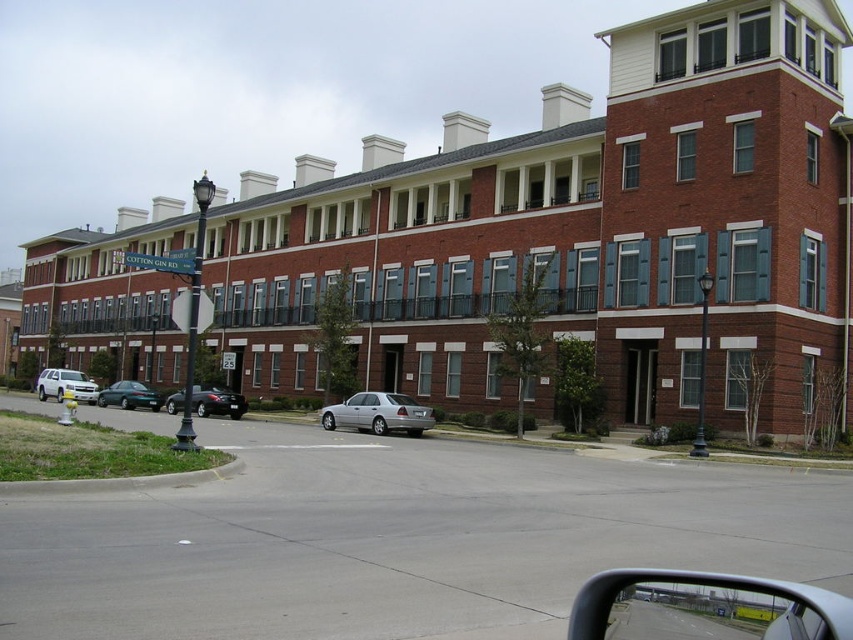
Does silver metallic sedan at center have a greater height compared to green matte sedan at center-left?

Yes.

Who is lower down, silver metallic sedan at center or green matte sedan at center-left?

green matte sedan at center-left

Is point (405, 404) positioned before point (123, 406)?

Yes, it is in front of point (123, 406).

Image resolution: width=853 pixels, height=640 pixels. I want to click on silver metallic sedan at center, so click(378, 413).

Looking at this image, who is more distant from viewer, (41, 387) or (100, 401)?

Point (41, 387)

Can you confirm if silver metallic suv at lower left is smaller than green matte sedan at center-left?

No.

Describe the element at coordinates (65, 385) in the screenshot. The width and height of the screenshot is (853, 640). I see `silver metallic suv at lower left` at that location.

Find the location of a particular element. silver metallic suv at lower left is located at coordinates (65, 385).

Where is `shiny black sedan at center`? The height and width of the screenshot is (640, 853). shiny black sedan at center is located at coordinates (218, 401).

Which of these two, shiny black sedan at center or green matte sedan at center-left, stands taller?

shiny black sedan at center

Between point (192, 392) and point (126, 385), which one is positioned behind?

Positioned behind is point (126, 385).

Find the location of a particular element. shiny black sedan at center is located at coordinates (218, 401).